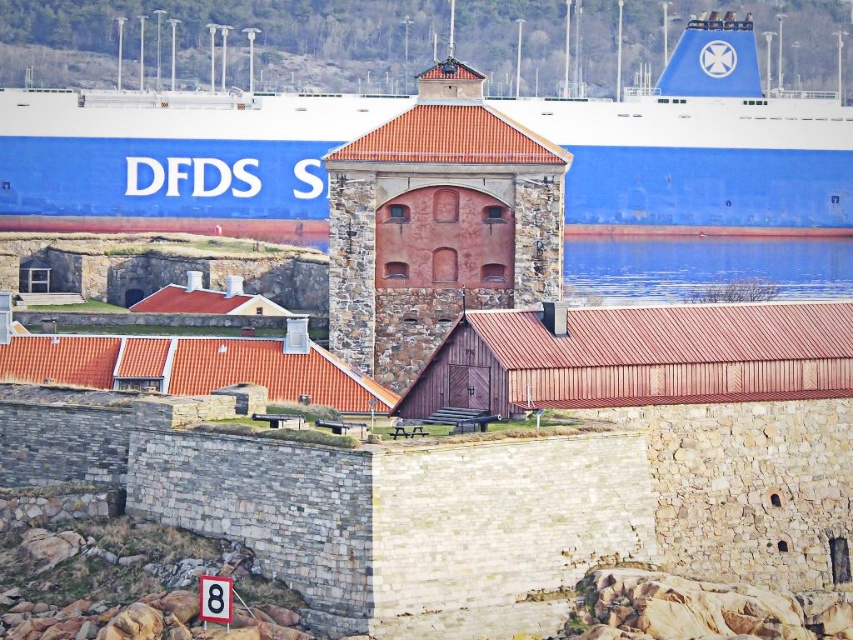
Question: Does blue matte ship at upper center appear on the left side of blue water at center?

Choices:
 (A) no
 (B) yes

Answer: (B)

Question: Which point is farther from the camera taking this photo?

Choices:
 (A) (651, 96)
 (B) (756, 257)

Answer: (A)

Question: Does blue matte ship at upper center appear on the right side of blue water at center?

Choices:
 (A) no
 (B) yes

Answer: (A)

Question: Observing the image, what is the correct spatial positioning of blue matte ship at upper center in reference to blue water at center?

Choices:
 (A) above
 (B) below

Answer: (A)

Question: Among these points, which one is farthest from the camera?

Choices:
 (A) (688, 275)
 (B) (776, 141)

Answer: (B)